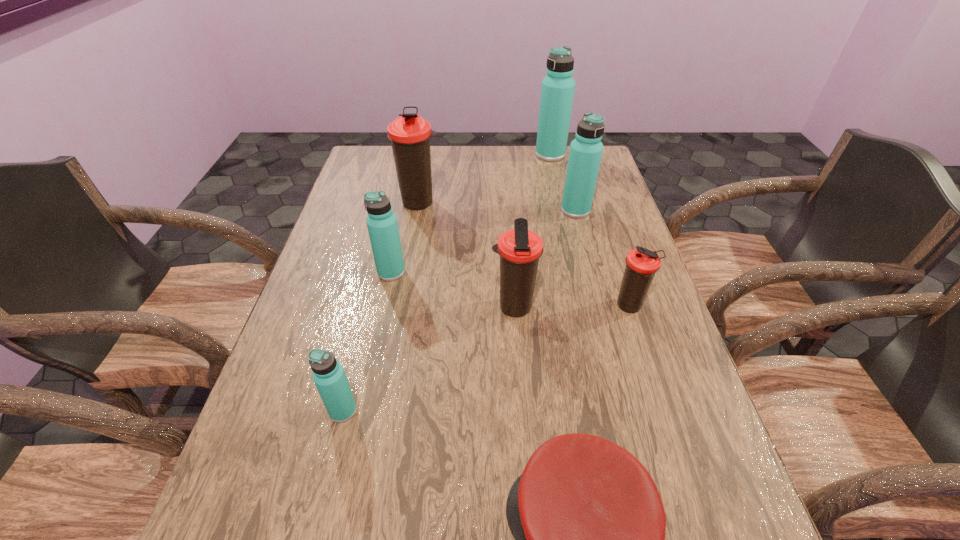
Identify the location of vacant area that lies between the farthest brown thermos bottle and the fourth thermos bottle from left to right. (467, 254).

Image resolution: width=960 pixels, height=540 pixels. What are the coordinates of `vacant space that's between the third smallest aqua thermos bottle and the biggest aqua thermos bottle` in the screenshot? It's located at (563, 182).

Point out which object is positioned as the seventh nearest to the second biggest brown thermos bottle. Please provide its 2D coordinates. Your answer should be formatted as a tuple, i.e. [(x, y)], where the tuple contains the x and y coordinates of a point satisfying the conditions above.

[(557, 92)]

Select which object is the sixth closest to the farthest brown thermos bottle. Please provide its 2D coordinates. Your answer should be formatted as a tuple, i.e. [(x, y)], where the tuple contains the x and y coordinates of a point satisfying the conditions above.

[(328, 375)]

Identify which thermos bottle is the sixth nearest to the second nearest aqua thermos bottle. Please provide its 2D coordinates. Your answer should be formatted as a tuple, i.e. [(x, y)], where the tuple contains the x and y coordinates of a point satisfying the conditions above.

[(557, 92)]

Point out which thermos bottle is positioned as the third nearest to the seventh farthest object. Please provide its 2D coordinates. Your answer should be formatted as a tuple, i.e. [(x, y)], where the tuple contains the x and y coordinates of a point satisfying the conditions above.

[(641, 264)]

Identify which aqua thermos bottle is the nearest to the biggest aqua thermos bottle. Please provide its 2D coordinates. Your answer should be formatted as a tuple, i.e. [(x, y)], where the tuple contains the x and y coordinates of a point satisfying the conditions above.

[(586, 149)]

Image resolution: width=960 pixels, height=540 pixels. In order to click on aqua thermos bottle that stands as the fourth closest to the second brown thermos bottle from left to right in this screenshot , I will do `click(557, 92)`.

Find the location of a particular element. This screenshot has width=960, height=540. brown thermos bottle that is the closest one to the nearest object is located at coordinates (520, 249).

Point out which brown thermos bottle is positioned as the second nearest to the red cap. Please provide its 2D coordinates. Your answer should be formatted as a tuple, i.e. [(x, y)], where the tuple contains the x and y coordinates of a point satisfying the conditions above.

[(641, 264)]